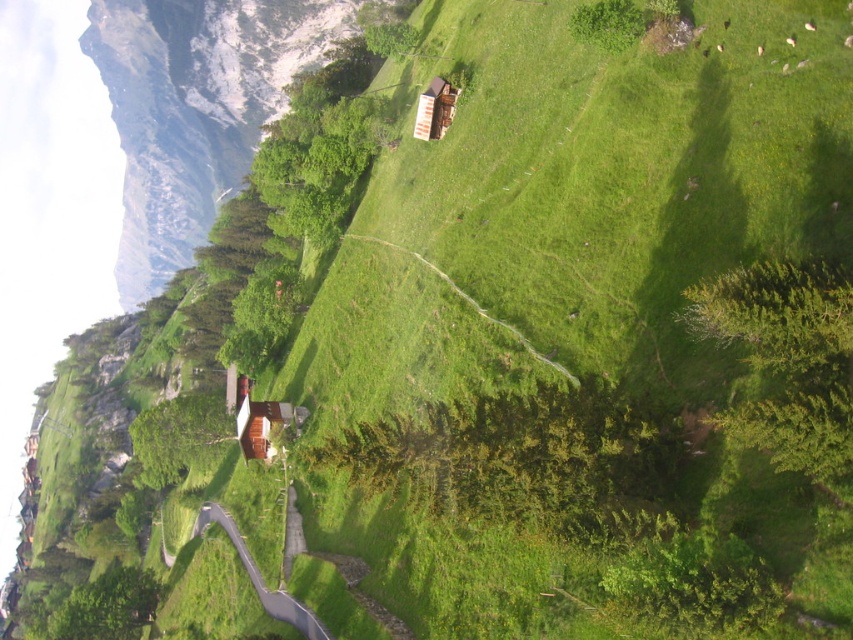
Is snowy rocky mountain at upper left wider than dark gray asphalt path at lower center?

Yes, snowy rocky mountain at upper left is wider than dark gray asphalt path at lower center.

This screenshot has width=853, height=640. What do you see at coordinates (195, 109) in the screenshot?
I see `snowy rocky mountain at upper left` at bounding box center [195, 109].

Does point (99, 72) come in front of point (331, 636)?

No, (99, 72) is further to viewer.

You are a GUI agent. You are given a task and a screenshot of the screen. Output one action in this format:
    pyautogui.click(x=<x>, y=<y>)
    Task: Click on the snowy rocky mountain at upper left
    
    Given the screenshot: What is the action you would take?
    pyautogui.click(x=195, y=109)

Which is more to the left, snowy rocky mountain at upper left or brown wooden cabin at center?

Positioned to the left is snowy rocky mountain at upper left.

Is point (308, 6) more distant than point (244, 396)?

Yes, point (308, 6) is farther from viewer.

This screenshot has height=640, width=853. Identify the location of snowy rocky mountain at upper left. (195, 109).

The height and width of the screenshot is (640, 853). What do you see at coordinates (195, 109) in the screenshot?
I see `snowy rocky mountain at upper left` at bounding box center [195, 109].

Is snowy rocky mountain at upper left above wooden cabin at center?

Yes, snowy rocky mountain at upper left is above wooden cabin at center.

Find the location of `snowy rocky mountain at upper left`. snowy rocky mountain at upper left is located at coordinates click(195, 109).

The width and height of the screenshot is (853, 640). I want to click on snowy rocky mountain at upper left, so click(x=195, y=109).